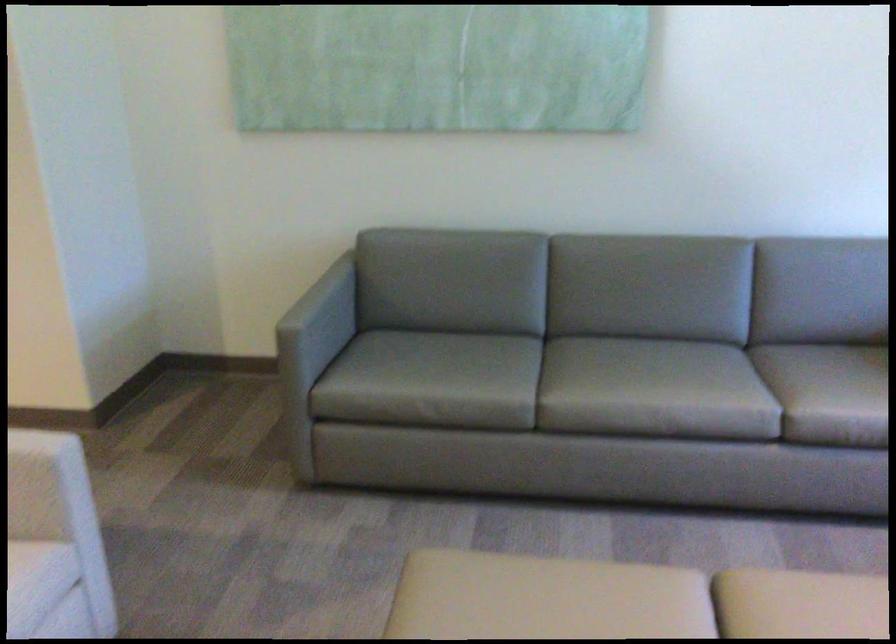
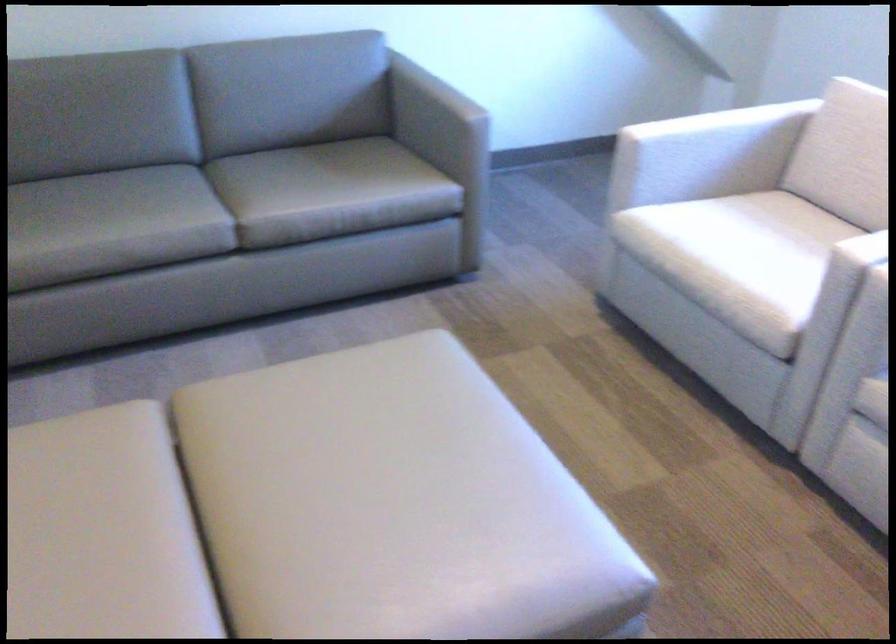
Question: How did the camera likely rotate?

Choices:
 (A) Left
 (B) Right
 (C) Up
 (D) Down

Answer: (B)